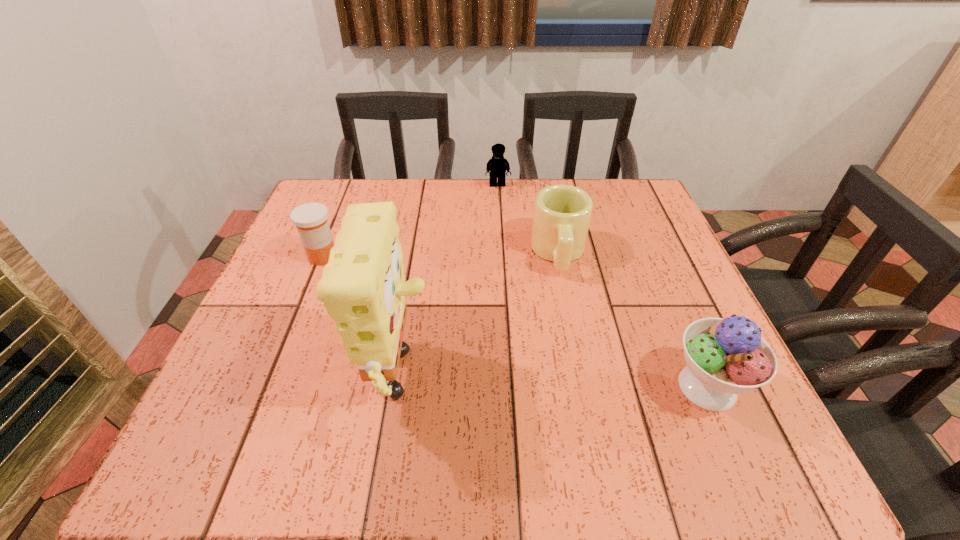
Find the location of a particular element. Image resolution: width=960 pixels, height=540 pixels. mug located in the far edge section of the desktop is located at coordinates (562, 213).

Locate an element on the screen. sponge that is at the near edge is located at coordinates (363, 287).

I want to click on icecream present at the near edge, so click(725, 357).

Where is `object that is positioned at the left edge`? object that is positioned at the left edge is located at coordinates pos(311,221).

Locate an element on the screen. The width and height of the screenshot is (960, 540). object that is positioned at the right edge is located at coordinates (725, 357).

In order to click on object located in the near right corner section of the desktop in this screenshot , I will do `click(725, 357)`.

In the image, there is a desktop. What are the coordinates of `blank space at the far edge` in the screenshot? It's located at (446, 203).

At what (x,y) coordinates should I click in order to perform the action: click on free space at the left edge of the desktop. Please return your answer as a coordinate pair (x, y). Looking at the image, I should click on (316, 360).

Identify the location of free space at the right edge of the desktop. The height and width of the screenshot is (540, 960). (683, 309).

Where is `vacant space at the far left corner`? This screenshot has height=540, width=960. vacant space at the far left corner is located at coordinates [321, 187].